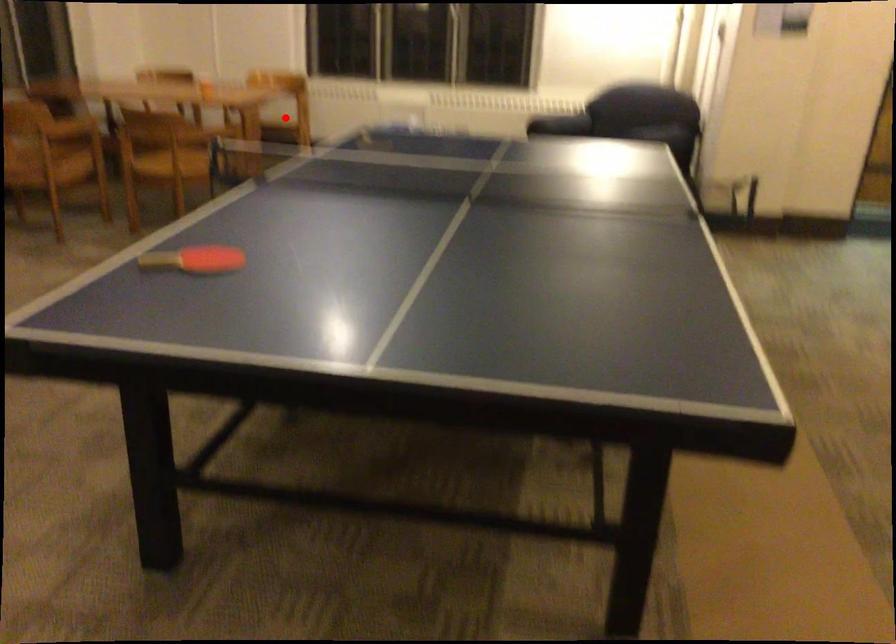
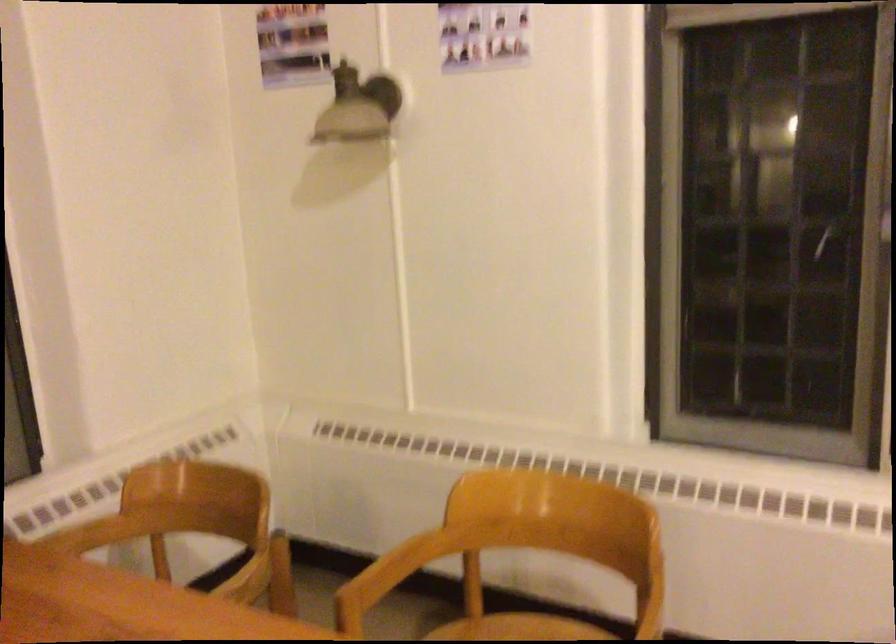
Question: I am providing you with two images of the same scene from different viewpoints. Image1 has a red point marked. In image2, the corresponding 3D location appears at what relative position? Reply with the corresponding letter.

Choices:
 (A) Closer
 (B) Farther

Answer: (A)